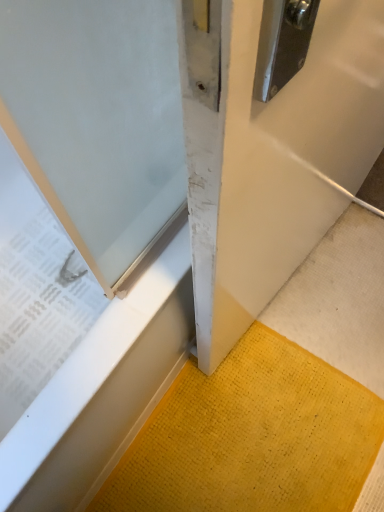
Locate an element on the screen. The height and width of the screenshot is (512, 384). white matte door at center is located at coordinates (277, 161).

What is the approximate height of white matte door at center?

The height of white matte door at center is 29.44 inches.

Image resolution: width=384 pixels, height=512 pixels. What do you see at coordinates (277, 161) in the screenshot?
I see `white matte door at center` at bounding box center [277, 161].

In order to click on yellow textured mat at lower right in this screenshot , I will do `click(252, 437)`.

What is the approximate width of yellow textured mat at lower right?

It is 51.25 centimeters.

What do you see at coordinates (252, 437) in the screenshot? This screenshot has width=384, height=512. I see `yellow textured mat at lower right` at bounding box center [252, 437].

I want to click on white matte door at center, so click(x=277, y=161).

Considering the relative positions of yellow textured mat at lower right and white matte door at center in the image provided, is yellow textured mat at lower right to the right of white matte door at center from the viewer's perspective?

Incorrect, yellow textured mat at lower right is not on the right side of white matte door at center.

From the picture: Between yellow textured mat at lower right and white matte door at center, which one is positioned in front?

white matte door at center is in front.

Is point (270, 461) closer to viewer compared to point (366, 154)?

No, (270, 461) is behind (366, 154).

From the image's perspective, who appears lower, yellow textured mat at lower right or white matte door at center?

yellow textured mat at lower right appears lower in the image.

From a real-world perspective, which is physically below, yellow textured mat at lower right or white matte door at center?

In real-world perspective, yellow textured mat at lower right is lower.

Can you confirm if yellow textured mat at lower right is wider than white matte door at center?

Correct, the width of yellow textured mat at lower right exceeds that of white matte door at center.

Is yellow textured mat at lower right taller than white matte door at center?

Incorrect, the height of yellow textured mat at lower right is not larger of that of white matte door at center.

In terms of size, does yellow textured mat at lower right appear bigger or smaller than white matte door at center?

Clearly, yellow textured mat at lower right is smaller in size than white matte door at center.

Is white matte door at center completely or partially inside yellow textured mat at lower right?

That's incorrect, white matte door at center is not inside yellow textured mat at lower right.

Can you see yellow textured mat at lower right touching white matte door at center?

There is a gap between yellow textured mat at lower right and white matte door at center.

Is yellow textured mat at lower right aimed at white matte door at center?

No, yellow textured mat at lower right is not aimed at white matte door at center.

How different are the orientations of yellow textured mat at lower right and white matte door at center in degrees?

6.32 degrees separate the facing orientations of yellow textured mat at lower right and white matte door at center.

Locate an element on the screen. The image size is (384, 512). doormat below the white matte door at center (from a real-world perspective) is located at coordinates (252, 437).

Does white matte door at center appear on the left side of yellow textured mat at lower right?

In fact, white matte door at center is to the right of yellow textured mat at lower right.

In the scene shown: Is white matte door at center positioned before yellow textured mat at lower right?

Yes, it is.

Which is less distant, [321,71] or [256,392]?

Point [321,71].

From the image's perspective, is white matte door at center located above yellow textured mat at lower right?

Correct, white matte door at center appears higher than yellow textured mat at lower right in the image.

From a real-world perspective, is white matte door at center located higher than yellow textured mat at lower right?

Yes, from a real-world perspective, white matte door at center is above yellow textured mat at lower right.

Can you confirm if white matte door at center is thinner than yellow textured mat at lower right?

Yes.

Considering the relative sizes of white matte door at center and yellow textured mat at lower right in the image provided, is white matte door at center taller than yellow textured mat at lower right?

Correct, white matte door at center is much taller as yellow textured mat at lower right.

Can you confirm if white matte door at center is bigger than yellow textured mat at lower right?

Indeed, white matte door at center has a larger size compared to yellow textured mat at lower right.

Is yellow textured mat at lower right a part of white matte door at center?

No, white matte door at center does not contain yellow textured mat at lower right.

Would you consider white matte door at center to be distant from yellow textured mat at lower right?

No.

Does white matte door at center turn towards yellow textured mat at lower right?

No, white matte door at center is not oriented towards yellow textured mat at lower right.

Can you tell me how much white matte door at center and yellow textured mat at lower right differ in facing direction?

The facing directions of white matte door at center and yellow textured mat at lower right are 6.32 degrees apart.

Based on the photo, measure the distance from white matte door at center to yellow textured mat at lower right.

They are 17.19 inches apart.

Identify the location of door on the right side of yellow textured mat at lower right. (277, 161).

At what (x,y) coordinates should I click in order to perform the action: click on door positioned vertically above the yellow textured mat at lower right (from a real-world perspective). Please return your answer as a coordinate pair (x, y). The image size is (384, 512). Looking at the image, I should click on (277, 161).

At what (x,y) coordinates should I click in order to perform the action: click on doormat beneath the white matte door at center (from a real-world perspective). Please return your answer as a coordinate pair (x, y). This screenshot has width=384, height=512. Looking at the image, I should click on [252, 437].